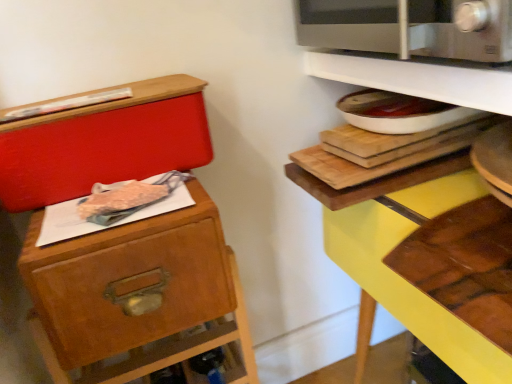
Question: Is the depth of white glossy shelf at upper right, positioned as the first shelf in top-to-bottom order, less than that of yellow wood shelf at upper right, which appears as the 1th shelf when ordered from the bottom?

Choices:
 (A) no
 (B) yes

Answer: (A)

Question: From a real-world perspective, does white glossy shelf at upper right, the 2th shelf when ordered from bottom to top, sit lower than yellow wood shelf at upper right, which appears as the 1th shelf when ordered from the bottom?

Choices:
 (A) yes
 (B) no

Answer: (B)

Question: Can you confirm if white glossy shelf at upper right, positioned as the first shelf in top-to-bottom order, is taller than yellow wood shelf at upper right, which ranks as the 2th shelf in top-to-bottom order?

Choices:
 (A) no
 (B) yes

Answer: (A)

Question: Can you confirm if white glossy shelf at upper right, the 2th shelf when ordered from bottom to top, is bigger than yellow wood shelf at upper right, which ranks as the 2th shelf in top-to-bottom order?

Choices:
 (A) yes
 (B) no

Answer: (B)

Question: Can you confirm if white glossy shelf at upper right, positioned as the first shelf in top-to-bottom order, is positioned to the left of yellow wood shelf at upper right, which ranks as the 2th shelf in top-to-bottom order?

Choices:
 (A) no
 (B) yes

Answer: (B)

Question: Could you tell me if white glossy shelf at upper right, the 2th shelf when ordered from bottom to top, is turned towards yellow wood shelf at upper right, which appears as the 1th shelf when ordered from the bottom?

Choices:
 (A) no
 (B) yes

Answer: (A)

Question: Is yellow wood shelf at upper right, which appears as the 1th shelf when ordered from the bottom, facing towards satin silver microwave at upper right?

Choices:
 (A) no
 (B) yes

Answer: (A)

Question: Is satin silver microwave at upper right at the back of yellow wood shelf at upper right, which appears as the 1th shelf when ordered from the bottom?

Choices:
 (A) yes
 (B) no

Answer: (B)

Question: Can you confirm if yellow wood shelf at upper right, which appears as the 1th shelf when ordered from the bottom, is taller than satin silver microwave at upper right?

Choices:
 (A) no
 (B) yes

Answer: (B)

Question: Is satin silver microwave at upper right located within yellow wood shelf at upper right, which ranks as the 2th shelf in top-to-bottom order?

Choices:
 (A) no
 (B) yes

Answer: (A)

Question: Does yellow wood shelf at upper right, which ranks as the 2th shelf in top-to-bottom order, have a lesser height compared to satin silver microwave at upper right?

Choices:
 (A) no
 (B) yes

Answer: (A)

Question: From the image's perspective, is yellow wood shelf at upper right, which ranks as the 2th shelf in top-to-bottom order, below satin silver microwave at upper right?

Choices:
 (A) yes
 (B) no

Answer: (A)

Question: Could satin silver microwave at upper right be considered to be inside matte red box at upper left?

Choices:
 (A) yes
 (B) no

Answer: (B)